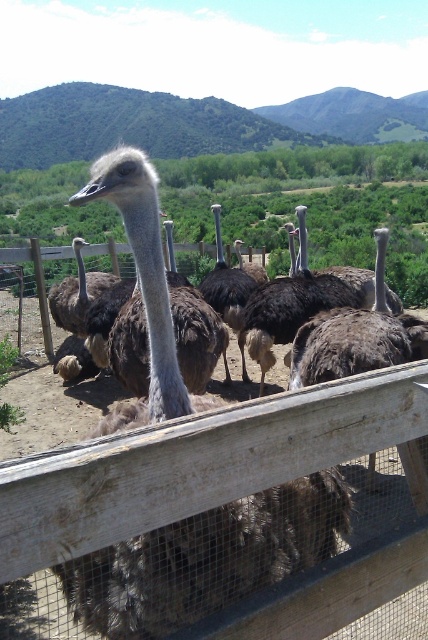
Who is positioned more to the left, wooden fence at center or dark brown feathers at center?

Positioned to the left is wooden fence at center.

Which is more to the right, wooden fence at center or dark brown feathers at center?

From the viewer's perspective, dark brown feathers at center appears more on the right side.

I want to click on wooden fence at center, so click(222, 520).